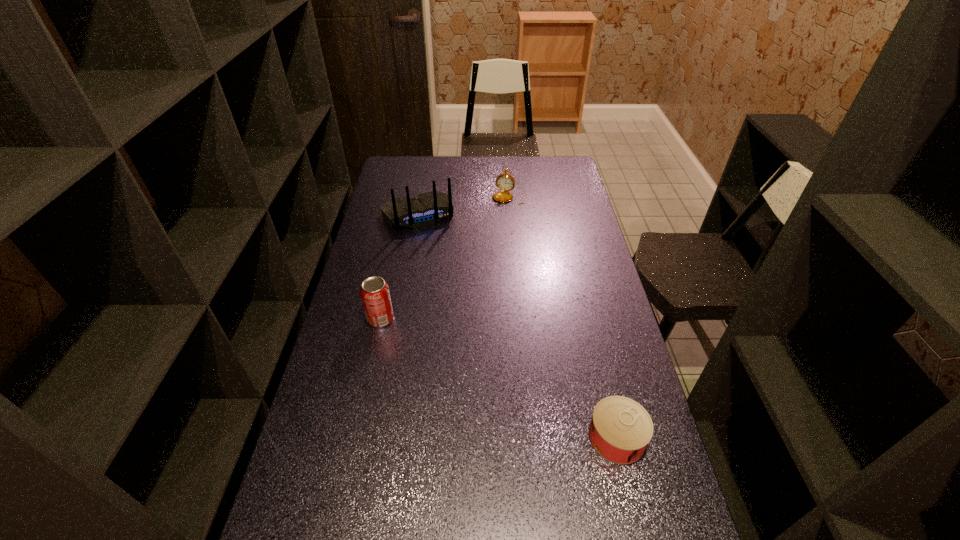
Locate an element on the screen. The width and height of the screenshot is (960, 540). free region located on the back of the tallest object is located at coordinates (435, 248).

What are the coordinates of `blank space located 0.100m on the back of the tallest object` in the screenshot? It's located at click(x=435, y=248).

This screenshot has height=540, width=960. Identify the location of vacant point located on the face of the pocket watch. [x=496, y=236].

Locate an element on the screen. vacant space located 0.140m on the face of the pocket watch is located at coordinates (500, 223).

Locate an element on the screen. This screenshot has width=960, height=540. vacant area situated on the face of the pocket watch is located at coordinates pyautogui.click(x=503, y=216).

Where is `soda can that is positioned at the left edge`? soda can that is positioned at the left edge is located at coordinates (375, 295).

Image resolution: width=960 pixels, height=540 pixels. In order to click on router that is at the left edge in this screenshot , I will do [425, 209].

You are a GUI agent. You are given a task and a screenshot of the screen. Output one action in this format:
    pyautogui.click(x=<x>, y=<y>)
    Task: Click on the object present at the right edge
    The width and height of the screenshot is (960, 540).
    Given the screenshot: What is the action you would take?
    pyautogui.click(x=620, y=430)

At what (x,y) coordinates should I click in order to perform the action: click on vacant space at the near edge of the desktop. Please return your answer as a coordinate pair (x, y). The height and width of the screenshot is (540, 960). Looking at the image, I should click on (460, 523).

Locate an element on the screen. free location at the left edge is located at coordinates (353, 363).